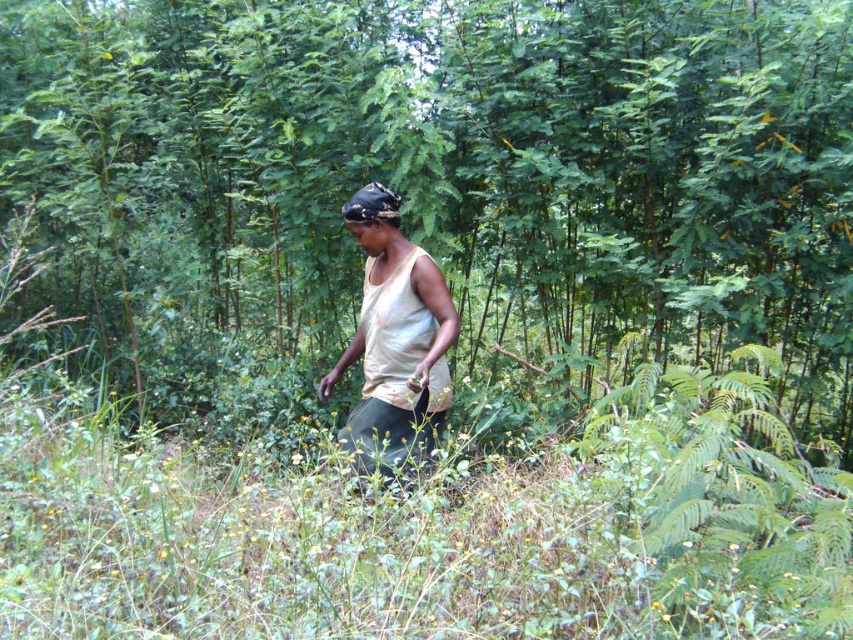
Question: Is green leafy tree at center to the right of white cotton tank top at center from the viewer's perspective?

Choices:
 (A) no
 (B) yes

Answer: (B)

Question: Can you confirm if green leafy tree at center is bigger than white cotton tank top at center?

Choices:
 (A) yes
 (B) no

Answer: (A)

Question: Which of the following is the farthest from the observer?

Choices:
 (A) coord(206,16)
 (B) coord(393,196)

Answer: (A)

Question: Can you confirm if green leafy tree at center is smaller than white cotton tank top at center?

Choices:
 (A) no
 (B) yes

Answer: (A)